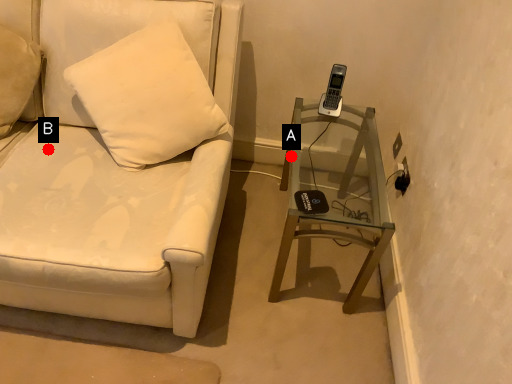
Question: Two points are circled on the image, labeled by A and B beside each circle. Among these points, which one is nearest to the camera?

Choices:
 (A) A is closer
 (B) B is closer

Answer: (B)